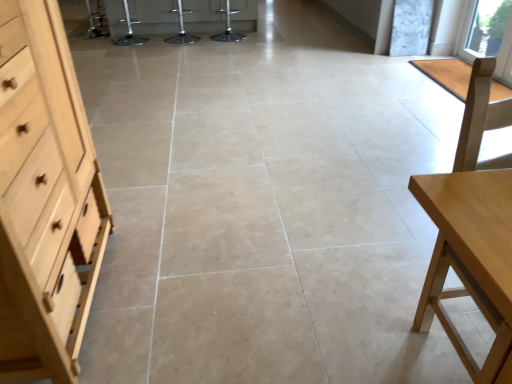
What do you see at coordinates (129, 31) in the screenshot? I see `metallic silver bar stool at center, positioned as the third bar stool in right-to-left order` at bounding box center [129, 31].

What do you see at coordinates (489, 36) in the screenshot?
I see `transparent glass window at upper right` at bounding box center [489, 36].

Locate an element on the screen. This screenshot has height=384, width=512. metallic silver bar stool at center, arranged as the second bar stool when viewed from the left is located at coordinates (182, 31).

You are a GUI agent. You are given a task and a screenshot of the screen. Output one action in this format:
    pyautogui.click(x=<x>, y=<y>)
    Task: Click on the light wood dresser at left
    
    Given the screenshot: What is the action you would take?
    pyautogui.click(x=45, y=198)

Where is `chest of drawers above the metallic silver bar stool at center, which appears as the 1th bar stool when viewed from the left (from a real-world perspective)`? This screenshot has height=384, width=512. chest of drawers above the metallic silver bar stool at center, which appears as the 1th bar stool when viewed from the left (from a real-world perspective) is located at coordinates (45, 198).

Is light wood dresser at left behind metallic silver bar stool at center, positioned as the third bar stool in right-to-left order?

No, light wood dresser at left is closer to the viewer.

Are light wood dresser at left and metallic silver bar stool at center, which appears as the 1th bar stool when viewed from the left, beside each other?

No, light wood dresser at left is not beside metallic silver bar stool at center, which appears as the 1th bar stool when viewed from the left.

Is light wood table at right to the left or to the right of transparent glass window at upper right in the image?

Based on their positions, light wood table at right is located to the left of transparent glass window at upper right.

Is light wood table at right looking in the opposite direction of transparent glass window at upper right?

light wood table at right is not turned away from transparent glass window at upper right.

Is metallic silver bar stool at center, which appears as the 1th bar stool when viewed from the left, to the left of transparent glass window at upper right from the viewer's perspective?

Indeed, metallic silver bar stool at center, which appears as the 1th bar stool when viewed from the left, is positioned on the left side of transparent glass window at upper right.

Looking at the image, does metallic silver bar stool at center, which appears as the 1th bar stool when viewed from the left, seem bigger or smaller compared to transparent glass window at upper right?

metallic silver bar stool at center, which appears as the 1th bar stool when viewed from the left, is bigger than transparent glass window at upper right.

How different are the orientations of metallic silver bar stool at center, positioned as the third bar stool in right-to-left order, and transparent glass window at upper right in degrees?

metallic silver bar stool at center, positioned as the third bar stool in right-to-left order, and transparent glass window at upper right are facing 92.7 degrees away from each other.

Who is smaller, metallic silver bar stool at center, the 1th bar stool positioned from the right, or transparent glass window at upper right?

transparent glass window at upper right is smaller.

In terms of width, does metallic silver bar stool at center, which is the third bar stool from left to right, look wider or thinner when compared to transparent glass window at upper right?

Clearly, metallic silver bar stool at center, which is the third bar stool from left to right, has more width compared to transparent glass window at upper right.

Is metallic silver bar stool at center, which is the third bar stool from left to right, facing towards transparent glass window at upper right?

No, metallic silver bar stool at center, which is the third bar stool from left to right, is not aimed at transparent glass window at upper right.

How different are the orientations of metallic silver bar stool at center, which is the third bar stool from left to right, and transparent glass window at upper right in degrees?

There is a 88.1-degree angle between the facing directions of metallic silver bar stool at center, which is the third bar stool from left to right, and transparent glass window at upper right.

Is point (479, 249) closer to viewer compared to point (23, 270)?

Yes.

Measure the distance between light wood table at right and light wood dresser at left.

3.96 feet.

Considering the positions of objects light wood table at right and light wood dresser at left in the image provided, who is behind, light wood table at right or light wood dresser at left?

light wood table at right is more distant.

From the image's perspective, between light wood dresser at left and metallic silver bar stool at center, which is the 2th bar stool from right to left, which one is located above?

metallic silver bar stool at center, which is the 2th bar stool from right to left, is shown above in the image.

Considering the positions of point (57, 241) and point (178, 11), is point (57, 241) closer or farther from the camera than point (178, 11)?

Point (57, 241).

Consider the image. Between light wood dresser at left and metallic silver bar stool at center, which is the 2th bar stool from right to left, which one has larger size?

light wood dresser at left is bigger.

Is metallic silver bar stool at center, arranged as the second bar stool when viewed from the left, at the back of light wood dresser at left?

That's not correct — light wood dresser at left is not looking away from metallic silver bar stool at center, arranged as the second bar stool when viewed from the left.

Is metallic silver bar stool at center, which is the third bar stool from left to right, beside metallic silver bar stool at center, which is the 2th bar stool from right to left?

metallic silver bar stool at center, which is the third bar stool from left to right, and metallic silver bar stool at center, which is the 2th bar stool from right to left, are clearly separated.

Considering the sizes of objects metallic silver bar stool at center, which is the third bar stool from left to right, and metallic silver bar stool at center, which is the 2th bar stool from right to left, in the image provided, who is wider, metallic silver bar stool at center, which is the third bar stool from left to right, or metallic silver bar stool at center, which is the 2th bar stool from right to left,?

With larger width is metallic silver bar stool at center, which is the third bar stool from left to right.

Which is more to the right, metallic silver bar stool at center, which is the third bar stool from left to right, or metallic silver bar stool at center, arranged as the second bar stool when viewed from the left?

metallic silver bar stool at center, which is the third bar stool from left to right.

Image resolution: width=512 pixels, height=384 pixels. Find the location of `the 2nd bar stool counting from the left of the light wood dresser at left`. the 2nd bar stool counting from the left of the light wood dresser at left is located at coordinates (129, 31).

Identify the location of window on the right of light wood table at right. The height and width of the screenshot is (384, 512). (489, 36).

Looking at the image, which one is located further to transparent glass window at upper right, metallic silver bar stool at center, which is the third bar stool from left to right, or metallic silver bar stool at center, which is the 2th bar stool from right to left?

metallic silver bar stool at center, which is the 2th bar stool from right to left, is further to transparent glass window at upper right.

When comparing their distances from metallic silver bar stool at center, which is the 2th bar stool from right to left, does light wood table at right or metallic silver bar stool at center, which is the third bar stool from left to right, seem closer?

metallic silver bar stool at center, which is the third bar stool from left to right.

When comparing their distances from metallic silver bar stool at center, which appears as the 1th bar stool when viewed from the left, does light wood table at right or metallic silver bar stool at center, arranged as the second bar stool when viewed from the left, seem closer?

metallic silver bar stool at center, arranged as the second bar stool when viewed from the left, lies closer to metallic silver bar stool at center, which appears as the 1th bar stool when viewed from the left, than the other object.

Estimate the real-world distances between objects in this image. Which object is further from metallic silver bar stool at center, arranged as the second bar stool when viewed from the left, metallic silver bar stool at center, the 1th bar stool positioned from the right, or transparent glass window at upper right?

Among the two, transparent glass window at upper right is located further to metallic silver bar stool at center, arranged as the second bar stool when viewed from the left.

Considering their positions, is transparent glass window at upper right positioned further to metallic silver bar stool at center, which appears as the 1th bar stool when viewed from the left, than light wood table at right?

The object further to metallic silver bar stool at center, which appears as the 1th bar stool when viewed from the left, is light wood table at right.

When comparing their distances from metallic silver bar stool at center, which is the 2th bar stool from right to left, does metallic silver bar stool at center, which appears as the 1th bar stool when viewed from the left, or light wood dresser at left seem further?

light wood dresser at left is positioned further to the anchor metallic silver bar stool at center, which is the 2th bar stool from right to left.

Considering their positions, is transparent glass window at upper right positioned further to light wood dresser at left than metallic silver bar stool at center, the 1th bar stool positioned from the right?

metallic silver bar stool at center, the 1th bar stool positioned from the right.

Based on the photo, considering their positions, is metallic silver bar stool at center, which is the 2th bar stool from right to left, positioned further to metallic silver bar stool at center, which is the third bar stool from left to right, than transparent glass window at upper right?

transparent glass window at upper right is positioned further to the anchor metallic silver bar stool at center, which is the third bar stool from left to right.

Where is `window between light wood table at right and metallic silver bar stool at center, which is the 2th bar stool from right to left, from front to back`? window between light wood table at right and metallic silver bar stool at center, which is the 2th bar stool from right to left, from front to back is located at coordinates (489, 36).

In order to click on table positioned between light wood dresser at left and metallic silver bar stool at center, which appears as the 1th bar stool when viewed from the left, from near to far in this screenshot , I will do `click(471, 259)`.

This screenshot has height=384, width=512. What are the coordinates of `window between light wood table at right and metallic silver bar stool at center, positioned as the third bar stool in right-to-left order, in the front-back direction` in the screenshot? It's located at (489, 36).

Identify the location of bar stool between metallic silver bar stool at center, arranged as the second bar stool when viewed from the left, and transparent glass window at upper right. Image resolution: width=512 pixels, height=384 pixels. (228, 29).